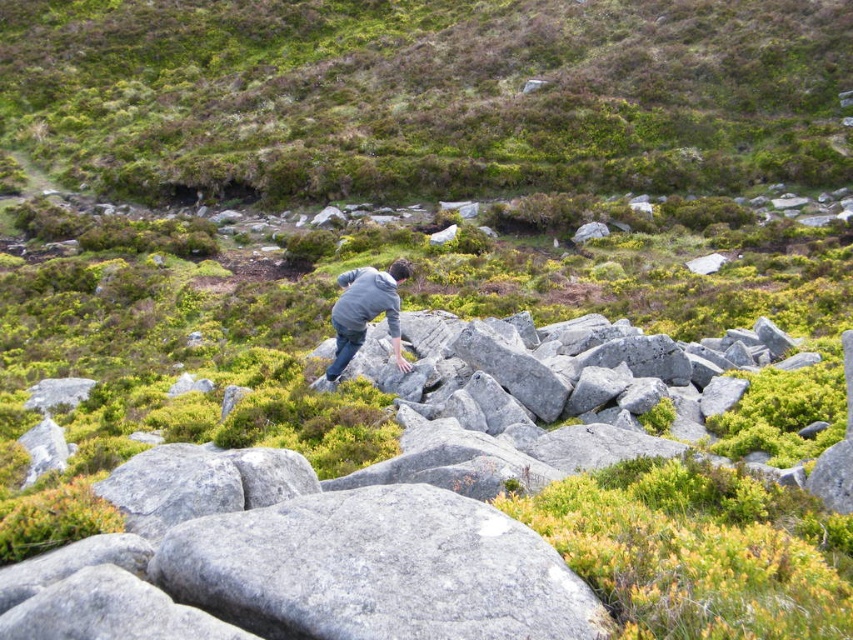
You are an outdoor photographer planning to take a photo of the gray granite rock at center and the gray matte jacket at center. Based on their sizes, which object should you focus on first to ensure it appears larger in the final image?

The gray matte jacket at center is larger than the gray granite rock at center, so you should focus on the gray matte jacket at center first to ensure it appears larger in the final image.

You are an outdoor adventurer trying to reach the summit. You see the gray granite rock at center and the gray matte jacket at center. Which object is closer to the ground?

The gray granite rock at center is positioned under the gray matte jacket at center, so the gray granite rock at center is closer to the ground.

Based on the photo, you are a hiker trying to reach the summit. You see the green mossy hillside at upper center and the gray matte jacket at center. Which object is higher up in the scene?

The green mossy hillside at upper center is much taller than the gray matte jacket at center, so the green mossy hillside at upper center is higher up in the scene.